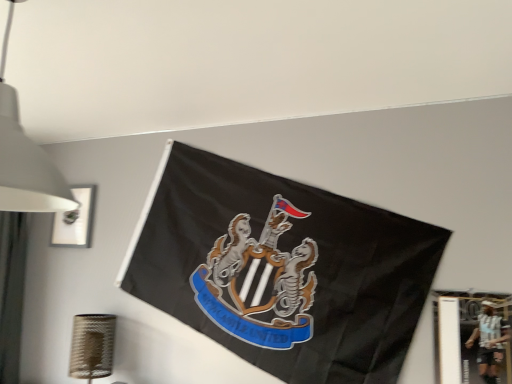
Question: From the image's perspective, relative to metallic silver picture frame at lower right, positioned as the first picture frame in bottom-to-top order, is white matte lampshade at upper left above or below?

Choices:
 (A) below
 (B) above

Answer: (B)

Question: Is white matte lampshade at upper left wider or thinner than metallic silver picture frame at lower right, positioned as the first picture frame in bottom-to-top order?

Choices:
 (A) wide
 (B) thin

Answer: (A)

Question: Considering the real-world distances, which object is closest to the matte white picture frame at upper left, the second picture frame from the front?

Choices:
 (A) metallic silver picture frame at lower right, which is counted as the 2th picture frame, starting from the top
 (B) white matte lampshade at upper left

Answer: (B)

Question: Which object is positioned farthest from the metallic silver picture frame at lower right, positioned as the first picture frame in bottom-to-top order?

Choices:
 (A) white matte lampshade at upper left
 (B) matte white picture frame at upper left, which appears as the second picture frame when ordered from the bottom

Answer: (B)